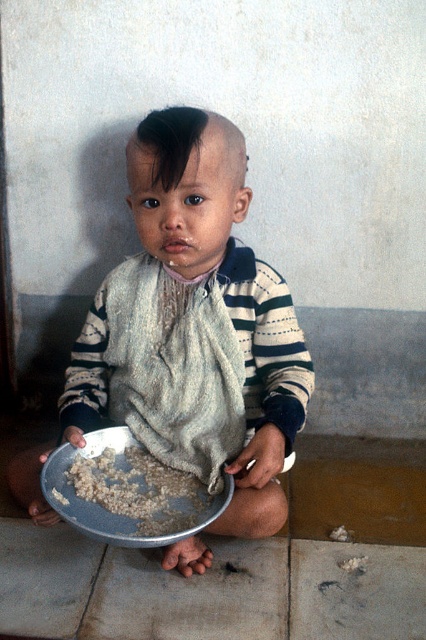
Between point (261, 352) and point (118, 508), which one is positioned behind?

Positioned behind is point (261, 352).

In the scene shown: Is striped cotton shirt at center above brown rice at lower center?

Yes, striped cotton shirt at center is above brown rice at lower center.

The height and width of the screenshot is (640, 426). Identify the location of striped cotton shirt at center. (203, 298).

The width and height of the screenshot is (426, 640). What are the coordinates of `striped cotton shirt at center` in the screenshot? It's located at (203, 298).